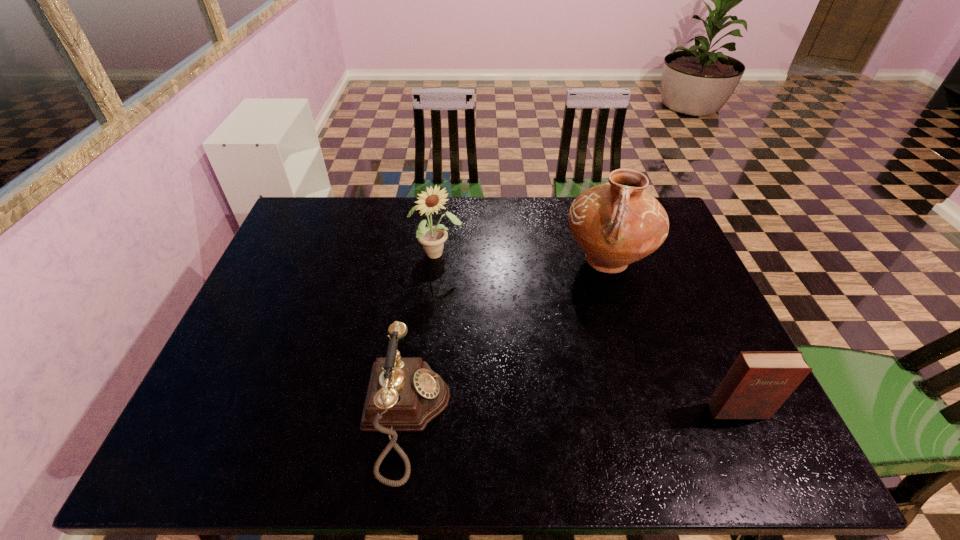
You are a GUI agent. You are given a task and a screenshot of the screen. Output one action in this format:
    pyautogui.click(x=<x>, y=<y>)
    Task: Click on the vacant space positioned 0.250m on the side of the pottery with the handle
    
    Given the screenshot: What is the action you would take?
    pyautogui.click(x=570, y=355)

Where is `object that is at the far edge`? Image resolution: width=960 pixels, height=540 pixels. object that is at the far edge is located at coordinates (617, 223).

You are a GUI agent. You are given a task and a screenshot of the screen. Output one action in this format:
    pyautogui.click(x=<x>, y=<y>)
    Task: Click on the telephone that is at the near edge
    The height and width of the screenshot is (540, 960).
    Given the screenshot: What is the action you would take?
    pyautogui.click(x=404, y=394)

Identify the location of diary that is at the near edge. (759, 382).

This screenshot has height=540, width=960. I want to click on diary that is at the right edge, so click(759, 382).

Locate an element on the screen. This screenshot has height=540, width=960. pottery present at the right edge is located at coordinates (617, 223).

You are a GUI agent. You are given a task and a screenshot of the screen. Output one action in this format:
    pyautogui.click(x=<x>, y=<y>)
    Task: Click on the object that is at the far right corner
    The width and height of the screenshot is (960, 540).
    Given the screenshot: What is the action you would take?
    pyautogui.click(x=617, y=223)

In order to click on object present at the near right corner in this screenshot , I will do `click(759, 382)`.

The width and height of the screenshot is (960, 540). What are the coordinates of `blank space at the far edge of the desktop` in the screenshot? It's located at (520, 233).

Identify the location of vacant space at the near edge of the desktop. The height and width of the screenshot is (540, 960). (310, 409).